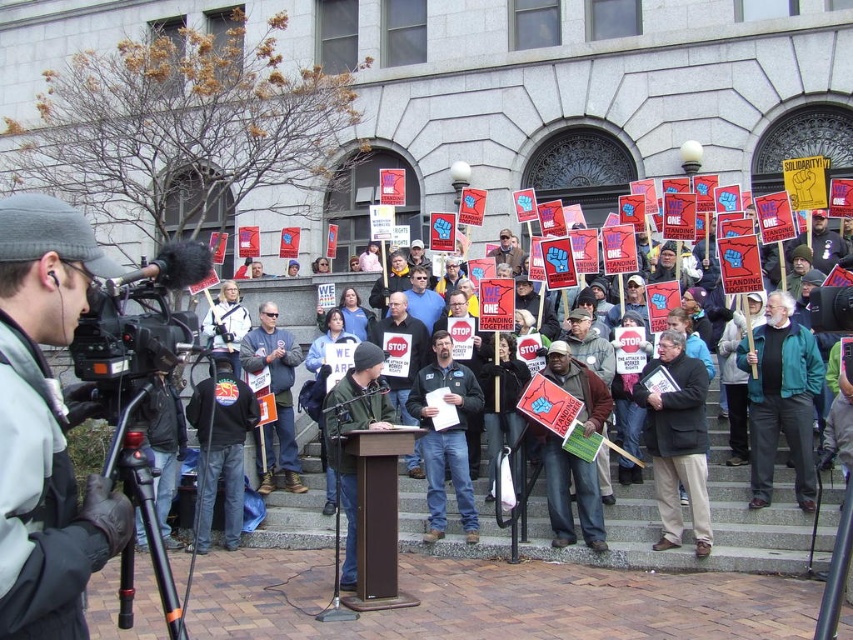
Question: Which point is closer to the camera taking this photo?

Choices:
 (A) 780,440
 (B) 67,332
 (C) 125,355

Answer: (B)

Question: From the image, what is the correct spatial relationship of matte black camera at left in relation to red paper signs at center?

Choices:
 (A) left
 (B) right

Answer: (A)

Question: Which object appears farthest from the camera in this image?

Choices:
 (A) matte black camera at left
 (B) black plastic video camera at left
 (C) red paper signs at center

Answer: (C)

Question: Is matte black camera at left to the left of black plastic video camera at left from the viewer's perspective?

Choices:
 (A) no
 (B) yes

Answer: (A)

Question: Does red paper signs at center come in front of black plastic video camera at left?

Choices:
 (A) no
 (B) yes

Answer: (A)

Question: Which object is positioned closest to the red paper signs at center?

Choices:
 (A) black plastic video camera at left
 (B) matte black camera at left

Answer: (A)